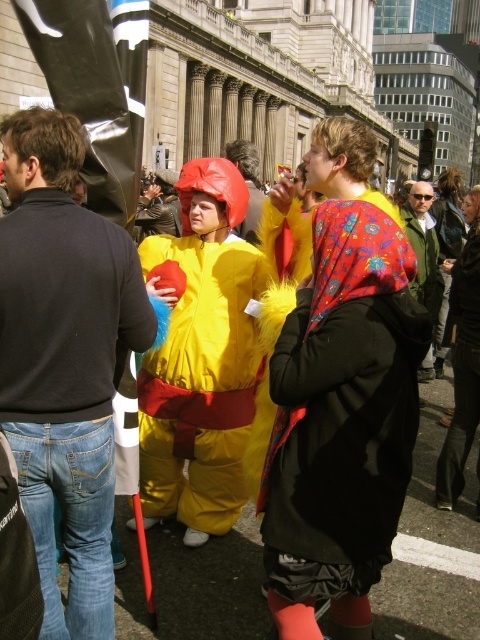
Question: Which object is positioned closest to the green textured jacket at center?

Choices:
 (A) yellow fabric costume at center
 (B) denim jacket at lower right

Answer: (B)

Question: Is floral fabric hood at center positioned in front of jeans at center?

Choices:
 (A) no
 (B) yes

Answer: (A)

Question: Can you confirm if floral fabric hood at center is positioned above yellow fuzzy costume at center?

Choices:
 (A) yes
 (B) no

Answer: (B)

Question: Which is nearer to the jeans at center?

Choices:
 (A) yellow fabric costume at center
 (B) yellow fuzzy costume at center
 (C) shiny black jacket at center

Answer: (B)

Question: Observing the image, what is the correct spatial positioning of jeans at center in reference to shiny black jacket at center?

Choices:
 (A) right
 (B) left

Answer: (B)

Question: Which of the following is the closest to the observer?

Choices:
 (A) (262, 198)
 (B) (261, 259)

Answer: (B)